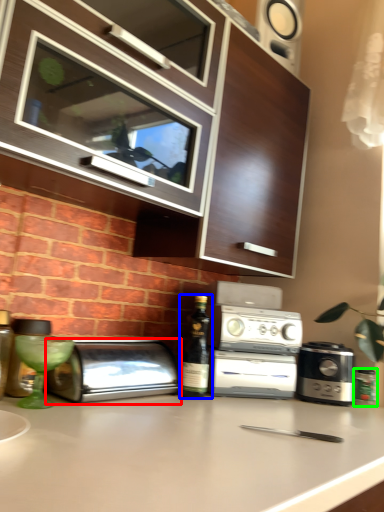
Question: Considering the real-world distances, which object is closest to toaster (highlighted by a red box)? wine bottle (highlighted by a blue box) or bottle (highlighted by a green box).

Choices:
 (A) wine bottle
 (B) bottle

Answer: (A)